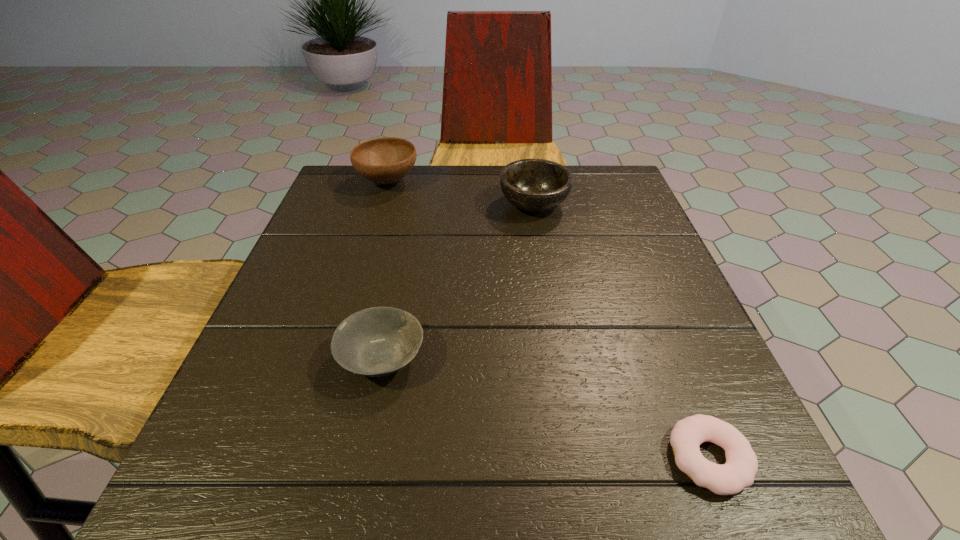
Where is `free space that is in between the doughnut and the second shortest object`? free space that is in between the doughnut and the second shortest object is located at coordinates (545, 408).

Where is `empty space between the rightmost object and the third farthest object`? The image size is (960, 540). empty space between the rightmost object and the third farthest object is located at coordinates point(545,408).

I want to click on unoccupied area between the rightmost object and the rightmost bowl, so click(621, 331).

Locate an element on the screen. Image resolution: width=960 pixels, height=540 pixels. free space between the nearest bowl and the second object from right to left is located at coordinates (458, 281).

Locate an element on the screen. free spot between the doughnut and the rightmost bowl is located at coordinates (621, 331).

Identify the location of vacant space in between the nearest bowl and the second object from right to left. This screenshot has height=540, width=960. (458, 281).

Where is `object that is the third nearest to the second object from right to left`? This screenshot has width=960, height=540. object that is the third nearest to the second object from right to left is located at coordinates (741, 466).

Select which object appears as the third closest to the third farthest object. Please provide its 2D coordinates. Your answer should be formatted as a tuple, i.e. [(x, y)], where the tuple contains the x and y coordinates of a point satisfying the conditions above.

[(385, 160)]

Point out which bowl is positioned as the nearest to the third object from left to right. Please provide its 2D coordinates. Your answer should be formatted as a tuple, i.e. [(x, y)], where the tuple contains the x and y coordinates of a point satisfying the conditions above.

[(385, 160)]

I want to click on the second closest bowl to the rightmost bowl, so click(374, 342).